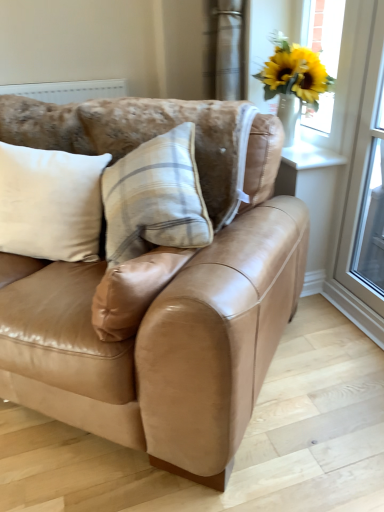
Question: In the image, is yellow artificial flowers in vase at upper right on the left side or the right side of transparent glass window at upper right?

Choices:
 (A) right
 (B) left

Answer: (B)

Question: Is yellow artificial flowers in vase at upper right wider or thinner than transparent glass window at upper right?

Choices:
 (A) thin
 (B) wide

Answer: (B)

Question: Which of these objects is positioned closest to the transparent glass screen door at right?

Choices:
 (A) transparent glass window at upper right
 (B) white soft cushion at left
 (C) yellow artificial flowers in vase at upper right
 (D) tan leather couch at center
 (E) white glossy window sill at upper right

Answer: (A)

Question: Based on their relative distances, which object is nearer to the transparent glass screen door at right?

Choices:
 (A) yellow artificial flowers in vase at upper right
 (B) tan leather couch at center
 (C) transparent glass window at upper right
 (D) satin curtain at upper right
 (E) white glossy window sill at upper right

Answer: (C)